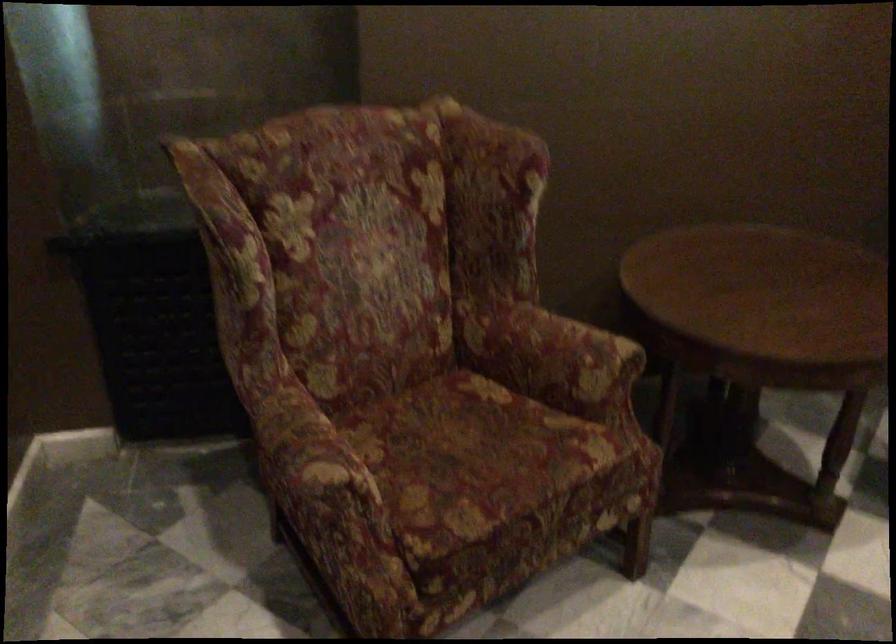
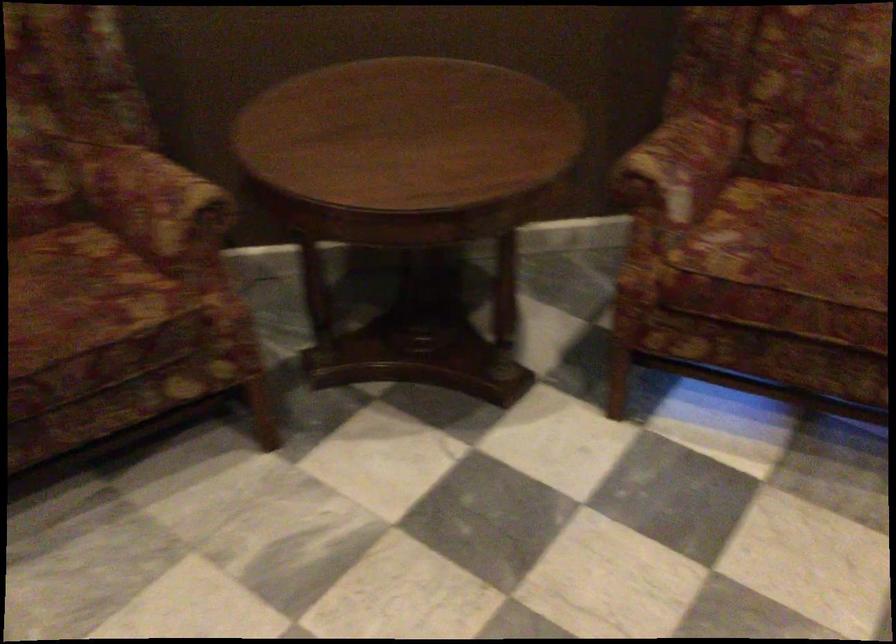
In the second image, find the point that corresponds to (572,353) in the first image.

(156, 204)